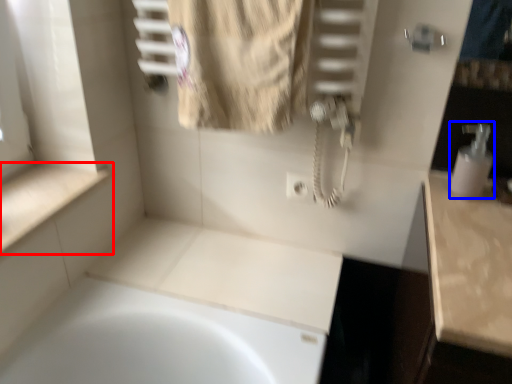
Question: Which point is further to the camera, counter top (highlighted by a red box) or soap dispenser (highlighted by a blue box)?

Choices:
 (A) counter top
 (B) soap dispenser

Answer: (B)